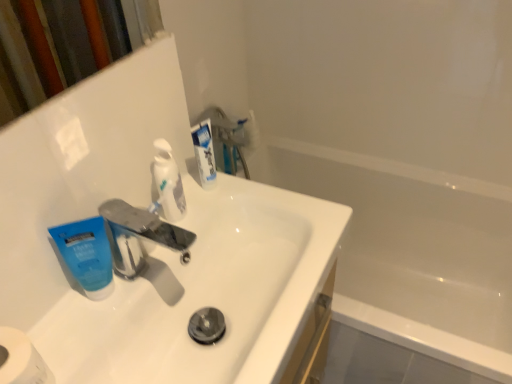
Question: Is blue matte toothpaste at left, which is the third toothpaste from right to left, positioned with its back to white matte toilet paper at lower left?

Choices:
 (A) yes
 (B) no

Answer: (B)

Question: Is the position of blue matte toothpaste at left, which is the third toothpaste from right to left, less distant than that of white matte toilet paper at lower left?

Choices:
 (A) yes
 (B) no

Answer: (B)

Question: Is white matte toilet paper at lower left surrounded by blue matte toothpaste at left, which ranks as the 1th toothpaste in left-to-right order?

Choices:
 (A) no
 (B) yes

Answer: (A)

Question: Is blue matte toothpaste at left, which ranks as the 1th toothpaste in left-to-right order, smaller than white matte toilet paper at lower left?

Choices:
 (A) yes
 (B) no

Answer: (A)

Question: From a real-world perspective, is blue matte toothpaste at left, which ranks as the 1th toothpaste in left-to-right order, positioned under white matte toilet paper at lower left based on gravity?

Choices:
 (A) no
 (B) yes

Answer: (A)

Question: Can you confirm if blue matte toothpaste at left, which ranks as the 1th toothpaste in left-to-right order, is positioned to the right of white matte toilet paper at lower left?

Choices:
 (A) yes
 (B) no

Answer: (A)

Question: Considering the relative positions of blue matte toothpaste at left, which ranks as the 1th toothpaste in left-to-right order, and white glossy toothpaste at upper center, which ranks as the 3th toothpaste in left-to-right order, in the image provided, is blue matte toothpaste at left, which ranks as the 1th toothpaste in left-to-right order, to the left of white glossy toothpaste at upper center, which ranks as the 3th toothpaste in left-to-right order, from the viewer's perspective?

Choices:
 (A) yes
 (B) no

Answer: (A)

Question: Is white glossy toothpaste at upper center, placed as the 1th toothpaste when sorted from right to left, completely or partially inside blue matte toothpaste at left, which is the third toothpaste from right to left?

Choices:
 (A) no
 (B) yes

Answer: (A)

Question: From the image's perspective, is blue matte toothpaste at left, which is the third toothpaste from right to left, over white glossy toothpaste at upper center, placed as the 1th toothpaste when sorted from right to left?

Choices:
 (A) no
 (B) yes

Answer: (A)

Question: Can you confirm if blue matte toothpaste at left, which is the third toothpaste from right to left, is taller than white glossy toothpaste at upper center, placed as the 1th toothpaste when sorted from right to left?

Choices:
 (A) no
 (B) yes

Answer: (A)

Question: Is blue matte toothpaste at left, which is the third toothpaste from right to left, thinner than white glossy toothpaste at upper center, placed as the 1th toothpaste when sorted from right to left?

Choices:
 (A) no
 (B) yes

Answer: (A)

Question: Does blue matte toothpaste at left, which is the third toothpaste from right to left, come in front of white glossy toothpaste at upper center, which ranks as the 3th toothpaste in left-to-right order?

Choices:
 (A) no
 (B) yes

Answer: (B)

Question: Does metallic silver faucet at center have a lesser width compared to white matte toilet paper at lower left?

Choices:
 (A) no
 (B) yes

Answer: (B)